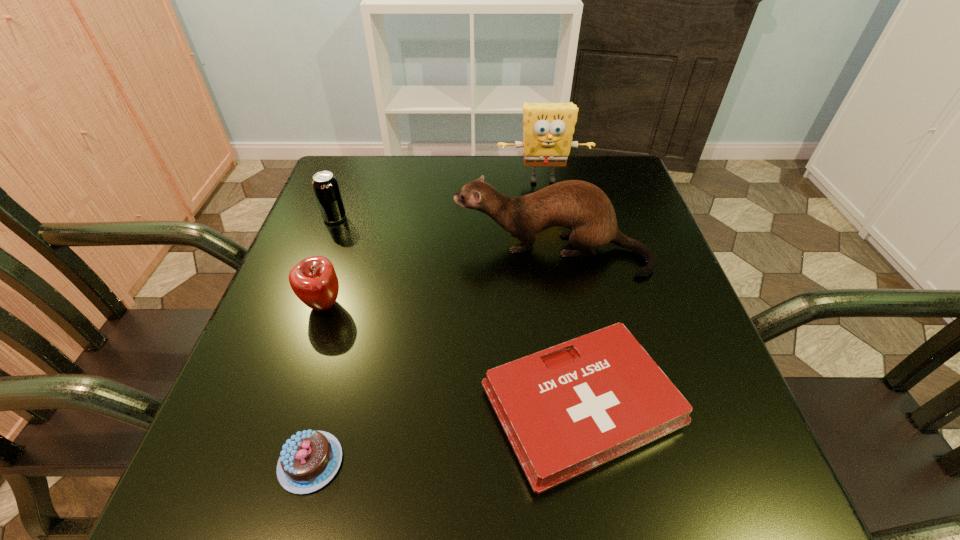
The image size is (960, 540). I want to click on vacant space at the left edge, so [x=326, y=222].

This screenshot has height=540, width=960. Find the location of `free space at the right edge of the desktop`. free space at the right edge of the desktop is located at coordinates (633, 224).

Where is `vacant space at the far right corner`? The height and width of the screenshot is (540, 960). vacant space at the far right corner is located at coordinates (602, 156).

This screenshot has width=960, height=540. Find the location of `free space at the near right corner of the desktop`. free space at the near right corner of the desktop is located at coordinates (752, 469).

Locate an element on the screen. The width and height of the screenshot is (960, 540). vacant area that lies between the fifth shortest object and the chocolate cake is located at coordinates (431, 357).

Locate an element on the screen. Image resolution: width=960 pixels, height=540 pixels. blank region between the soda can and the chocolate cake is located at coordinates (323, 340).

At what (x,y) coordinates should I click in order to perform the action: click on vacant area that lies between the ferret and the fifth nearest object. Please return your answer as a coordinate pair (x, y). Looking at the image, I should click on (443, 235).

The height and width of the screenshot is (540, 960). I want to click on free space between the sponge and the second farthest object, so tap(439, 199).

Locate an element on the screen. empty space that is in between the second farthest object and the chocolate cake is located at coordinates (323, 340).

Locate an element on the screen. vacant point located between the first-aid kit and the third nearest object is located at coordinates 452,356.